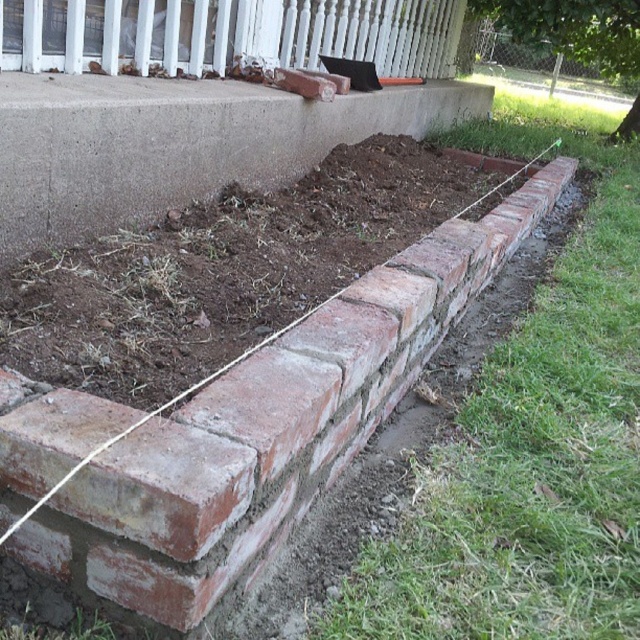
You are a contractor working on a garden renovation. You need to determine which structure requires more materials for expansion. Based on the scene, which one is smaller and thus might need less material? Please refer to the red brick wall at lower right and the smooth white porch at upper center.

The red brick wall at lower right is smaller than the smooth white porch at upper center, so it might need less material for expansion.

You are a gardener who needs to place a 30 inch wide gardening tool on the ground between you and the red brick wall at lower right. Is there enough space to place it without moving the tool?

The distance between you and the red brick wall at lower right is 31.41 inches. Since the tool is 30 inches wide, there is enough space to place it without moving the tool.

In the scene shown: You are designing a garden layout and need to place a 2x4 wooden plank between the red brick wall at lower right and the smooth white porch at upper center. Based on their widths, which object will have more space left after placing the plank?

The red brick wall at lower right has a smaller width compared to the smooth white porch at upper center. Therefore, placing the 2x4 wooden plank between them would leave more space remaining on the smooth white porch at upper center.